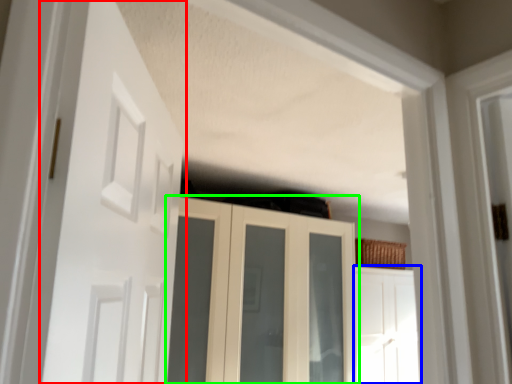
Question: Estimate the real-world distances between objects in this image. Which object is farther from door (highlighted by a red box), door (highlighted by a blue box) or cupboard (highlighted by a green box)?

Choices:
 (A) door
 (B) cupboard

Answer: (A)